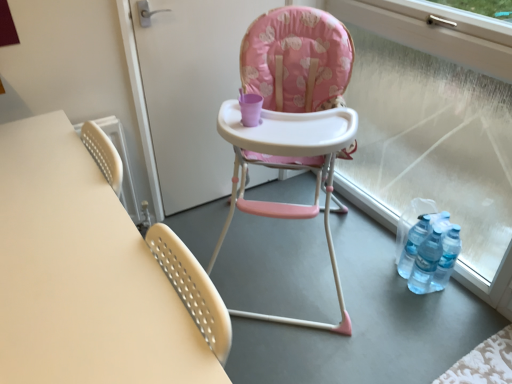
Question: Is transparent glass window at right wider or thinner than matte white table at left?

Choices:
 (A) thin
 (B) wide

Answer: (A)

Question: Visually, is transparent glass window at right positioned to the left or to the right of matte white table at left?

Choices:
 (A) right
 (B) left

Answer: (A)

Question: Which object is positioned farthest from the transparent glass window at right?

Choices:
 (A) matte white table at left
 (B) pink fabric highchair at center
 (C) pink fabric high chair at center

Answer: (A)

Question: Which is farther from the transparent glass window at right?

Choices:
 (A) pink fabric high chair at center
 (B) pink fabric highchair at center
 (C) matte white table at left

Answer: (C)